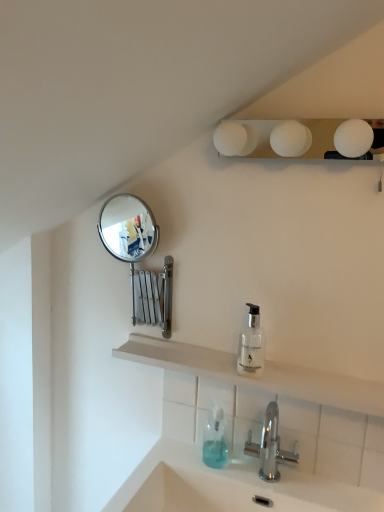
Identify the location of vacant space to the left of transparent glass soap dispenser at center, positioned as the first soap dispenser in top-to-bottom order. (200, 355).